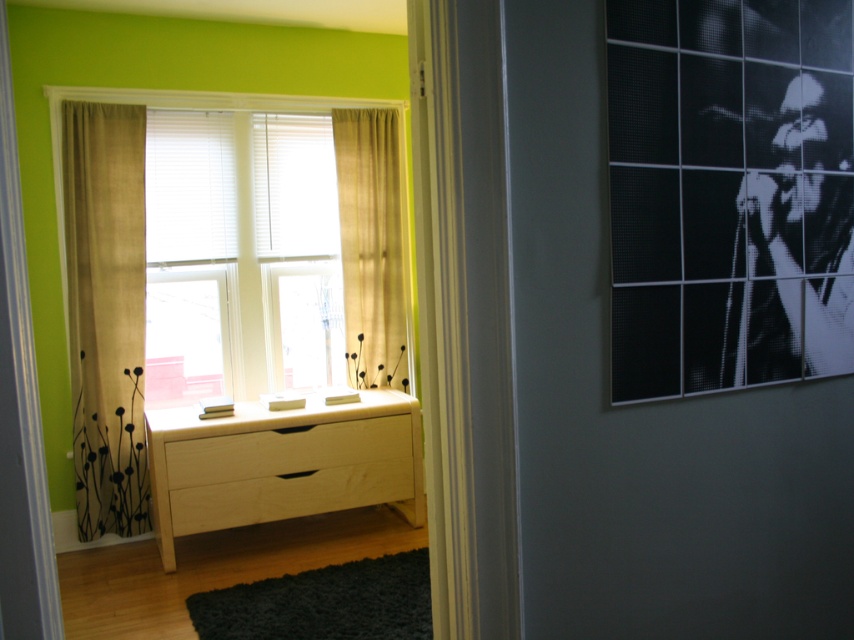
You are a delivery person trying to place a package that is 10 inches wide on the floor between the beige fabric curtain at center and the matte wood window at center. Can the package fit in that space?

The distance between the beige fabric curtain at center and the matte wood window at center is 9.67 inches. Since the package is 10 inches wide, it cannot fit in the available space.

You are standing in the doorway and want to know which object is taller between the burlap curtain at left and the matte wood window at center. Can you tell me which one is taller?

The burlap curtain at left has a greater height compared to the matte wood window at center, so the burlap curtain at left is taller.

You are standing in the doorway and want to move the burlap curtain at left to let more light in. Can you move it without touching the matte wood window at center?

The burlap curtain at left is positioned under the matte wood window at center, so moving it would not require touching the window.